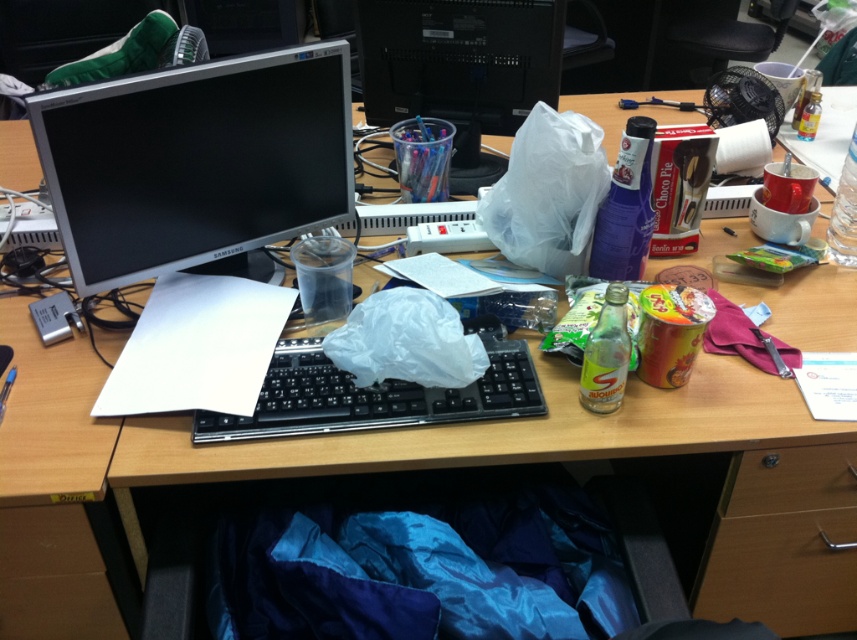
Question: Which point is farther to the camera?

Choices:
 (A) wooden drawer at lower center
 (B) transparent plastic cup at upper center

Answer: (B)

Question: Is the position of transparent plastic cup at upper center less distant than that of black plastic keyboard at center?

Choices:
 (A) no
 (B) yes

Answer: (A)

Question: Is transparent plastic cup at upper center thinner than wooden drawer at lower center?

Choices:
 (A) yes
 (B) no

Answer: (B)

Question: Which object is positioned closest to the wooden drawer at lower center?

Choices:
 (A) satin silver monitor at upper left
 (B) black plastic keyboard at center

Answer: (B)

Question: Is transparent plastic cup at upper center thinner than black plastic keyboard at center?

Choices:
 (A) yes
 (B) no

Answer: (A)

Question: Which is farther from the black plastic keyboard at center?

Choices:
 (A) satin silver monitor at upper left
 (B) transparent plastic cup at upper center

Answer: (B)